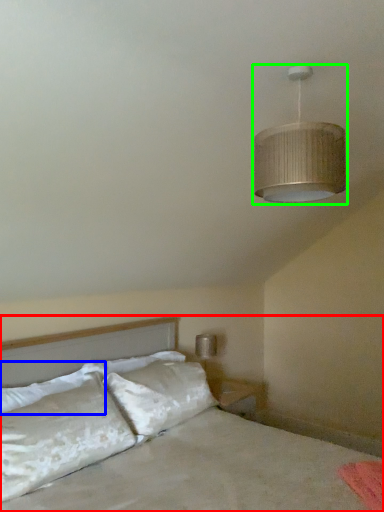
Question: Which object is positioned closest to bed (highlighted by a red box)? Select from pillow (highlighted by a blue box) and lamp (highlighted by a green box).

Choices:
 (A) pillow
 (B) lamp

Answer: (A)